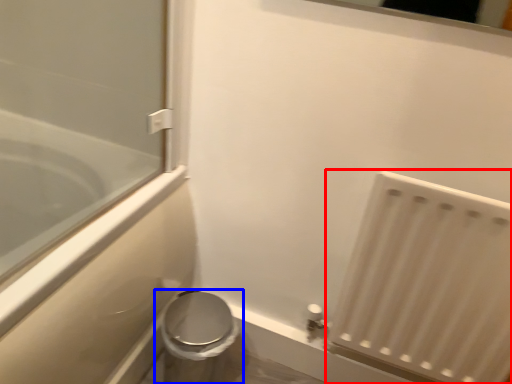
Question: Which object appears farthest to the camera in this image, radiator (highlighted by a red box) or toilet (highlighted by a blue box)?

Choices:
 (A) radiator
 (B) toilet

Answer: (B)